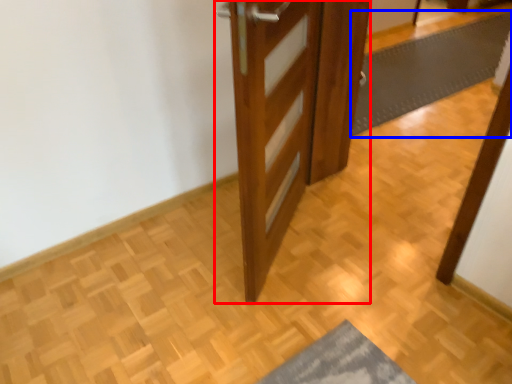
Question: Among these objects, which one is nearest to the camera, door (highlighted by a red box) or bath mat (highlighted by a blue box)?

Choices:
 (A) door
 (B) bath mat

Answer: (A)